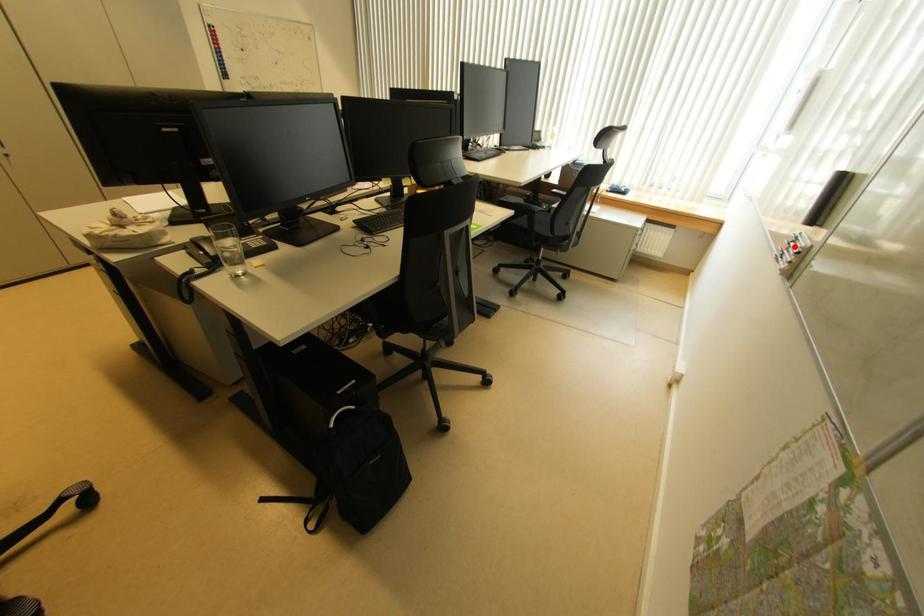
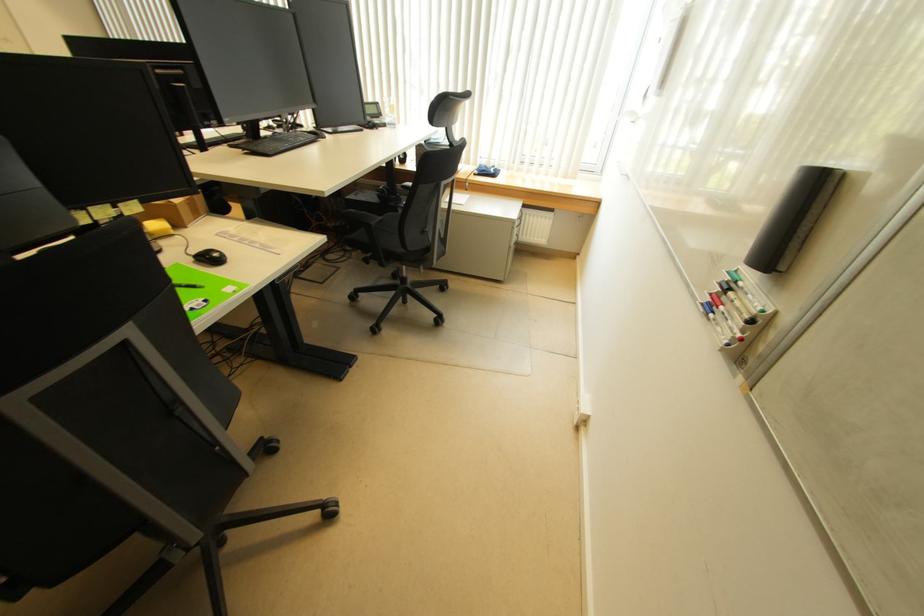
Locate, in the second image, the point that corresponds to the highlighted location in the first image.

(733, 296)